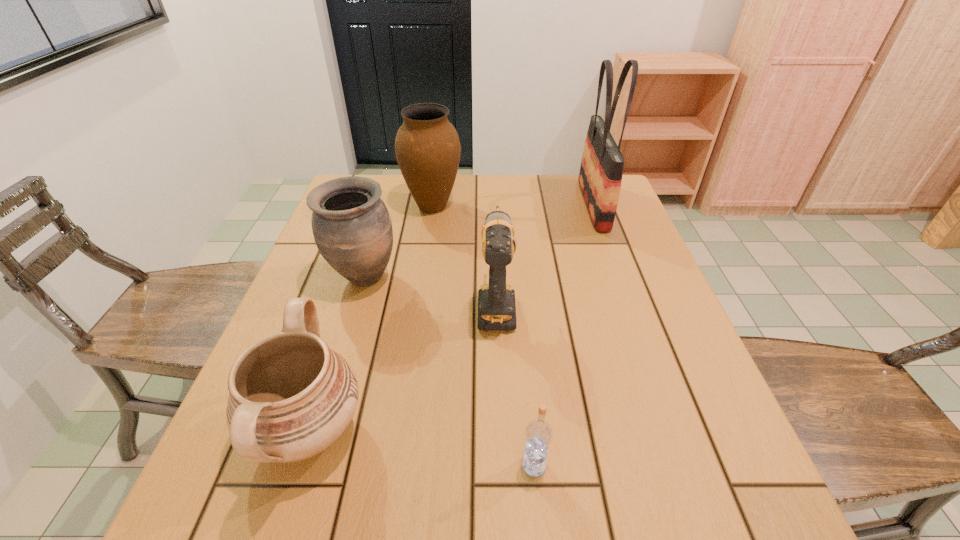
Locate an element on the screen. Image resolution: width=960 pixels, height=540 pixels. the second closest urn to the shopping bag is located at coordinates (352, 228).

At what (x,y) coordinates should I click in order to perform the action: click on urn that is the second closest one to the nearest urn. Please return your answer as a coordinate pair (x, y). Image resolution: width=960 pixels, height=540 pixels. Looking at the image, I should click on (427, 147).

Find the location of a particular element. The height and width of the screenshot is (540, 960). free spot that satisfies the following two spatial constraints: 1. on the front-facing side of the nearest urn; 2. on the left side of the vodka is located at coordinates (299, 465).

The height and width of the screenshot is (540, 960). I want to click on vacant space that satisfies the following two spatial constraints: 1. on the front side of the farthest urn; 2. on the front-facing side of the nearest urn, so click(x=398, y=431).